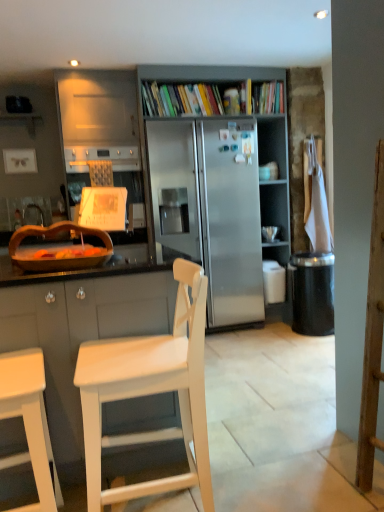
Question: Is white wood chair at center, arranged as the first chair when viewed from the right, thinner than wooden bowl at left?

Choices:
 (A) no
 (B) yes

Answer: (A)

Question: Does white wood chair at center, arranged as the first chair when viewed from the right, touch wooden bowl at left?

Choices:
 (A) yes
 (B) no

Answer: (B)

Question: Is white wood chair at center, arranged as the first chair when viewed from the right, located outside wooden bowl at left?

Choices:
 (A) no
 (B) yes

Answer: (B)

Question: Is white wood chair at center, the 2th chair positioned from the left, at the left side of wooden bowl at left?

Choices:
 (A) no
 (B) yes

Answer: (A)

Question: Considering the relative sizes of white wood chair at center, the 2th chair positioned from the left, and wooden bowl at left in the image provided, is white wood chair at center, the 2th chair positioned from the left, bigger than wooden bowl at left?

Choices:
 (A) yes
 (B) no

Answer: (A)

Question: From the image's perspective, is wooden bowl at left located above or below stainless steel refrigerator at center?

Choices:
 (A) above
 (B) below

Answer: (B)

Question: Considering the relative positions of wooden bowl at left and stainless steel refrigerator at center in the image provided, is wooden bowl at left to the left or to the right of stainless steel refrigerator at center?

Choices:
 (A) right
 (B) left

Answer: (B)

Question: Is point (104, 242) closer or farther from the camera than point (193, 254)?

Choices:
 (A) closer
 (B) farther

Answer: (A)

Question: Relative to stainless steel refrigerator at center, is wooden bowl at left in front or behind?

Choices:
 (A) behind
 (B) front

Answer: (B)

Question: Do you think white cloth at right is within white matte chair at lower left, positioned as the first chair in left-to-right order, or outside of it?

Choices:
 (A) outside
 (B) inside

Answer: (A)

Question: Is point (322, 248) positioned closer to the camera than point (9, 374)?

Choices:
 (A) farther
 (B) closer

Answer: (A)

Question: Considering the positions of white cloth at right and white matte chair at lower left, positioned as the first chair in left-to-right order, in the image, is white cloth at right wider or thinner than white matte chair at lower left, positioned as the first chair in left-to-right order,?

Choices:
 (A) thin
 (B) wide

Answer: (A)

Question: Is white cloth at right in front of or behind white matte chair at lower left, arranged as the 2th chair when viewed from the right, in the image?

Choices:
 (A) behind
 (B) front

Answer: (A)

Question: Considering the positions of point (326, 217) and point (264, 179), is point (326, 217) closer or farther from the camera than point (264, 179)?

Choices:
 (A) farther
 (B) closer

Answer: (B)

Question: From the image's perspective, relative to matte blue coffee cup at upper right, is white cloth at right above or below?

Choices:
 (A) below
 (B) above

Answer: (A)